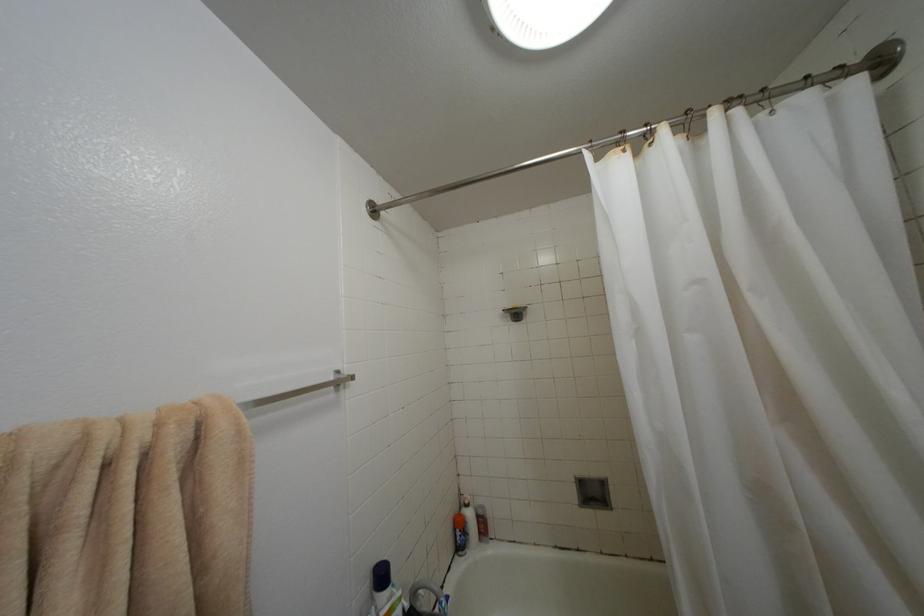
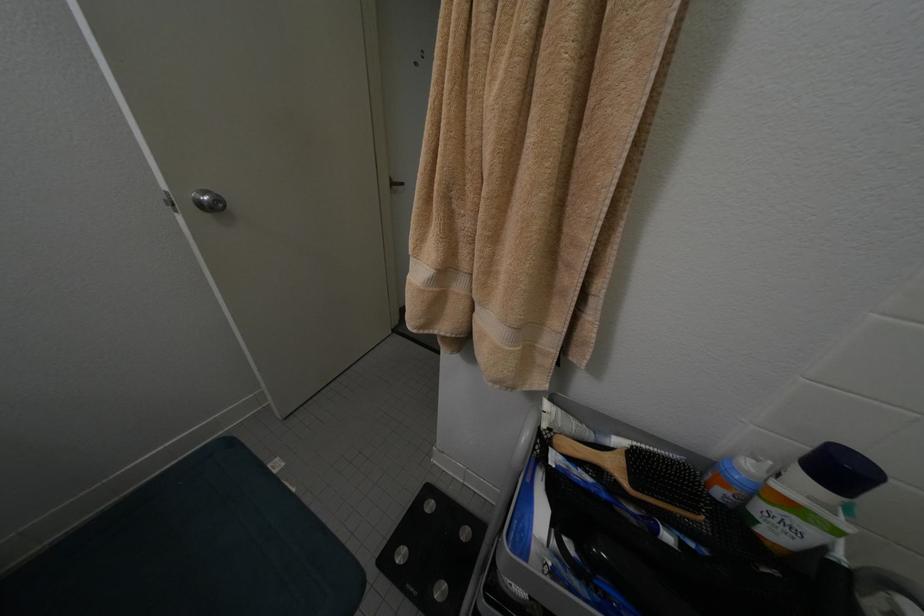
The images are taken continuously from a first-person perspective. In which direction is your viewpoint rotating?

The camera's rotation is toward left-down.